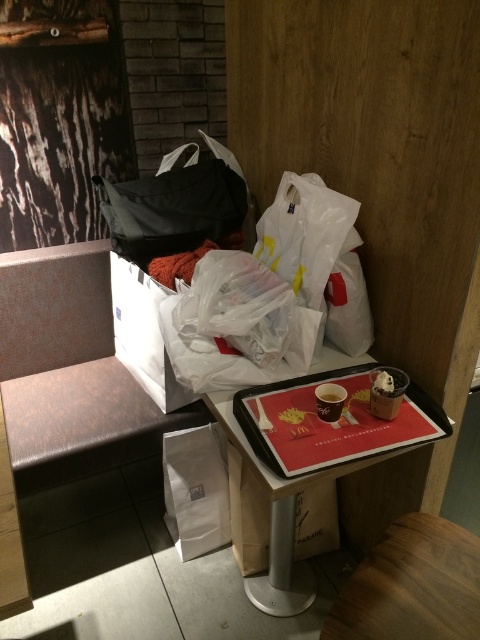
Question: Does white plastic bag at upper center lie in front of matte plastic cup at center?

Choices:
 (A) no
 (B) yes

Answer: (A)

Question: Among these objects, which one is nearest to the camera?

Choices:
 (A) cardboard tray at center
 (B) yellow crumbly snack at center

Answer: (B)

Question: Where is yellow crumbly snack at center located in relation to matte plastic cup at center in the image?

Choices:
 (A) right
 (B) left

Answer: (B)

Question: Which of these objects is positioned farthest from the white paper bag at lower center?

Choices:
 (A) red matte tray at center
 (B) black fabric bag at upper center
 (C) matte plastic cup at lower center

Answer: (B)

Question: Estimate the real-world distances between objects in this image. Which object is closer to the cardboard tray at center?

Choices:
 (A) wooden stool at lower right
 (B) matte plastic cup at lower center
 (C) black fabric bag at upper center
 (D) white paper bag at lower center

Answer: (D)

Question: Does red matte tray at center have a greater width compared to matte plastic cup at lower center?

Choices:
 (A) no
 (B) yes

Answer: (B)